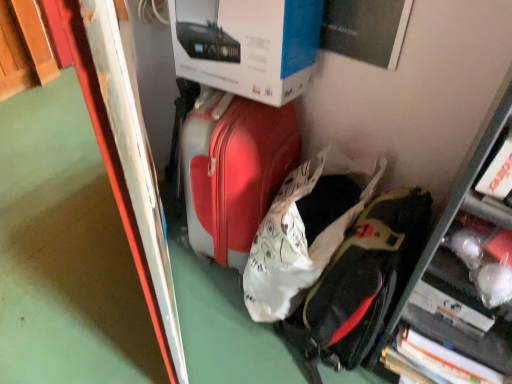
Question: From a real-world perspective, is metallic silver bulletin board at left below white cardboard box at upper center?

Choices:
 (A) yes
 (B) no

Answer: (A)

Question: Does metallic silver bulletin board at left have a lesser width compared to white cardboard box at upper center?

Choices:
 (A) yes
 (B) no

Answer: (A)

Question: Could white cardboard box at upper center be considered to be inside metallic silver bulletin board at left?

Choices:
 (A) yes
 (B) no

Answer: (B)

Question: Can you confirm if metallic silver bulletin board at left is wider than white cardboard box at upper center?

Choices:
 (A) no
 (B) yes

Answer: (A)

Question: Is the position of metallic silver bulletin board at left more distant than that of white cardboard box at upper center?

Choices:
 (A) no
 (B) yes

Answer: (A)

Question: In terms of size, does metallic silver bulletin board at left appear bigger or smaller than matte red suitcase at center?

Choices:
 (A) small
 (B) big

Answer: (B)

Question: From a real-world perspective, is metallic silver bulletin board at left positioned above or below matte red suitcase at center?

Choices:
 (A) above
 (B) below

Answer: (A)

Question: Would you say metallic silver bulletin board at left is inside or outside matte red suitcase at center?

Choices:
 (A) inside
 (B) outside

Answer: (B)

Question: From the image's perspective, relative to matte red suitcase at center, is metallic silver bulletin board at left above or below?

Choices:
 (A) below
 (B) above

Answer: (B)

Question: Would you say metallic silver bulletin board at left is to the left or to the right of black matte backpack at lower right in the picture?

Choices:
 (A) right
 (B) left

Answer: (B)

Question: Would you say metallic silver bulletin board at left is inside or outside black matte backpack at lower right?

Choices:
 (A) outside
 (B) inside

Answer: (A)

Question: Looking at the image, does metallic silver bulletin board at left seem bigger or smaller compared to black matte backpack at lower right?

Choices:
 (A) big
 (B) small

Answer: (A)

Question: In terms of height, does metallic silver bulletin board at left look taller or shorter compared to black matte backpack at lower right?

Choices:
 (A) tall
 (B) short

Answer: (A)

Question: Does point (276, 31) appear closer or farther from the camera than point (324, 317)?

Choices:
 (A) closer
 (B) farther

Answer: (A)

Question: Is white cardboard box at upper center spatially inside black matte backpack at lower right, or outside of it?

Choices:
 (A) outside
 (B) inside

Answer: (A)